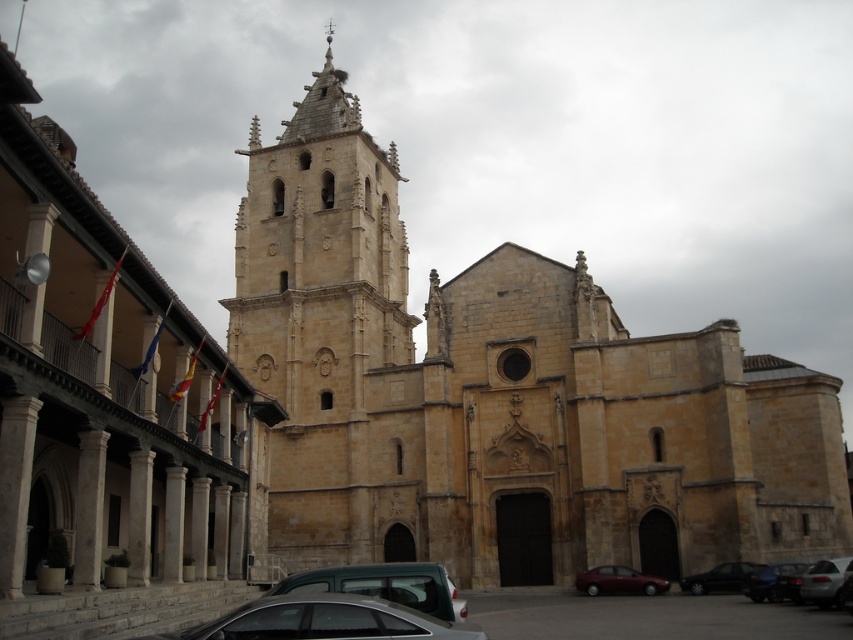
Between point (805, 588) and point (718, 584), which one is positioned behind?

The point (718, 584) is behind.

Does silver metallic car at lower right lie in front of dark gray metallic car at lower right?

Yes, silver metallic car at lower right is in front of dark gray metallic car at lower right.

Does point (824, 605) come closer to viewer compared to point (706, 580)?

Yes, it is.

Find the location of `silver metallic car at lower right`. silver metallic car at lower right is located at coordinates (822, 580).

Who is shorter, yellow stone church at center or beige stone church at center?

beige stone church at center

Can you confirm if yellow stone church at center is positioned below beige stone church at center?

Incorrect, yellow stone church at center is not positioned below beige stone church at center.

Is point (532, 269) more distant than point (45, 534)?

Yes, point (532, 269) is behind point (45, 534).

Where is `yellow stone church at center`? The width and height of the screenshot is (853, 640). yellow stone church at center is located at coordinates (498, 394).

Which of these two, silver metallic car at lower center or shiny black sedan at lower right, stands taller?

silver metallic car at lower center is taller.

Who is higher up, silver metallic car at lower center or shiny black sedan at lower right?

silver metallic car at lower center

Between point (213, 632) and point (769, 596), which one is positioned behind?

The point (769, 596) is behind.

The image size is (853, 640). Identify the location of silver metallic car at lower center. (323, 620).